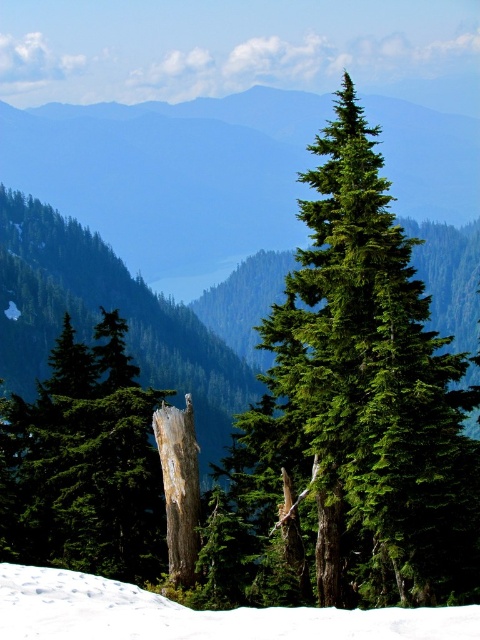
In the scene shown: Between green needle-like at center and white textured bark at center, which one has less height?

white textured bark at center

Based on the photo, which is more to the right, green needle-like at center or white textured bark at center?

Positioned to the right is green needle-like at center.

Does point (345, 524) come behind point (176, 488)?

No.

At what (x,y) coordinates should I click in order to perform the action: click on green needle-like at center. Please return your answer as a coordinate pair (x, y). This screenshot has width=480, height=640. Looking at the image, I should click on (350, 417).

Does green needle-like at center appear over white snow at lower left?

Actually, green needle-like at center is below white snow at lower left.

Does point (320, 276) come closer to viewer compared to point (170, 618)?

No, it is behind (170, 618).

Is point (420, 460) closer to camera compared to point (14, 572)?

Yes, it is in front of point (14, 572).

The image size is (480, 640). I want to click on green needle-like at center, so click(x=350, y=417).

Who is more forward, (409,625) or (197,536)?

Point (409,625) is more forward.

Which of these two, white snow at lower left or white textured bark at center, stands taller?

white textured bark at center is taller.

The height and width of the screenshot is (640, 480). Describe the element at coordinates (194, 614) in the screenshot. I see `white snow at lower left` at that location.

Locate an element on the screen. The height and width of the screenshot is (640, 480). white snow at lower left is located at coordinates (194, 614).